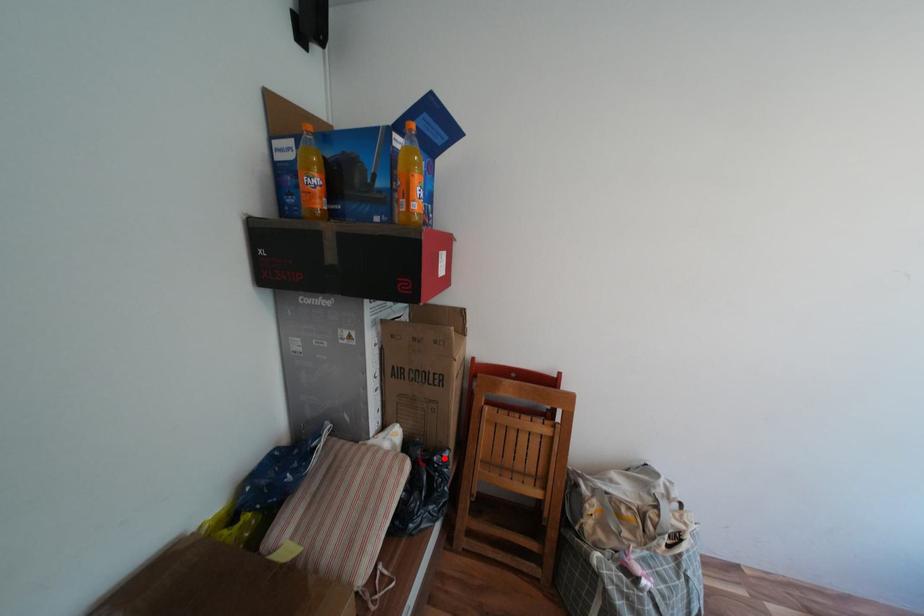
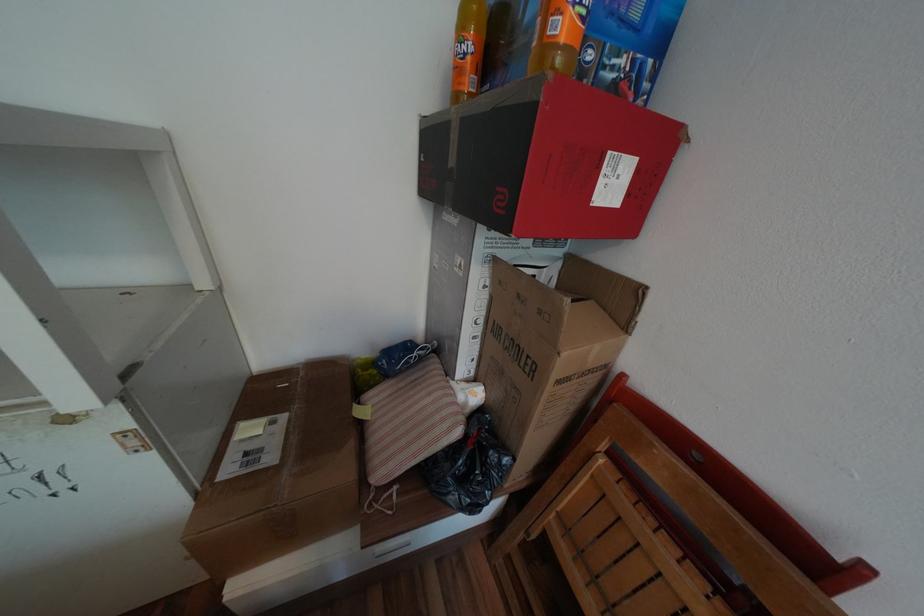
Find the pixel in the second image that matches the highlighted location in the first image.

(500, 453)